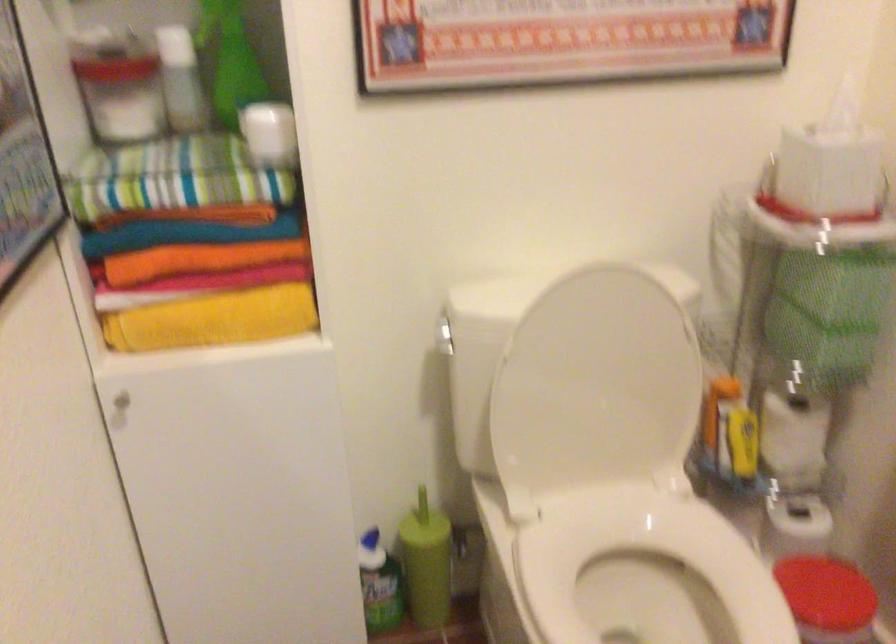
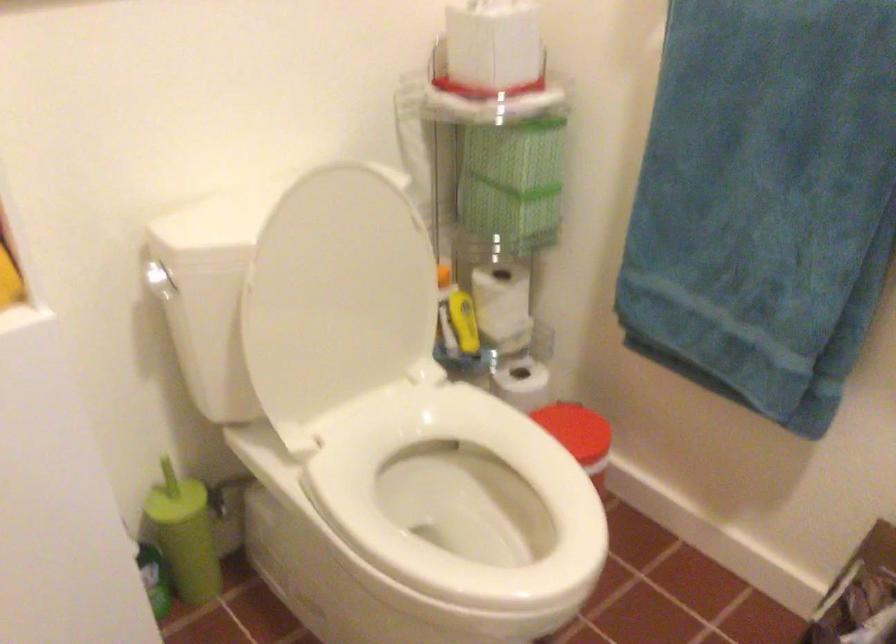
Question: The first image is from the beginning of the video and the second image is from the end. How did the camera likely rotate when shooting the video?

Choices:
 (A) Left
 (B) Right
 (C) Up
 (D) Down

Answer: (B)